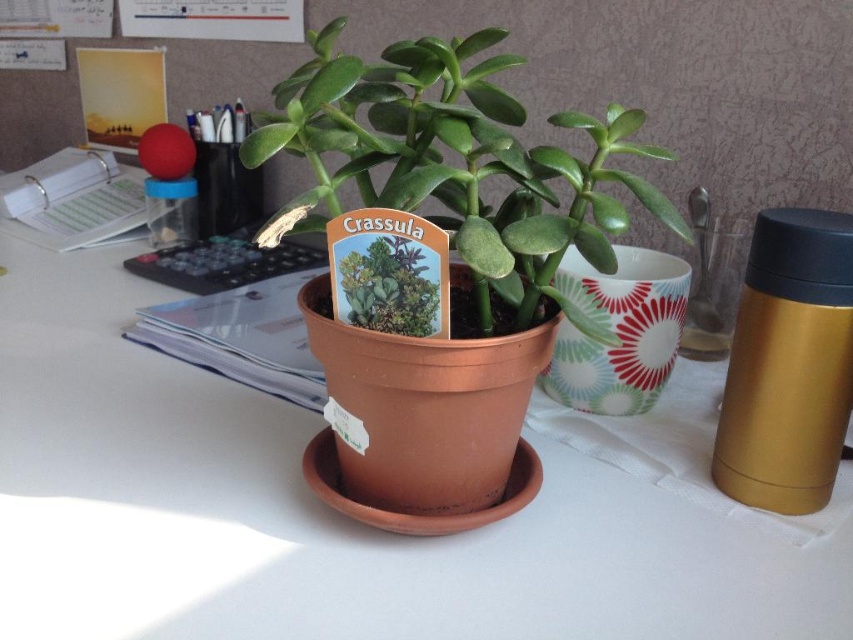
Locate an element on the screen. matte brown pot at center is located at coordinates point(321,513).

Does matte brown pot at center have a lesser width compared to matte clay pot at center?

No, matte brown pot at center is not thinner than matte clay pot at center.

Is point (48, 458) closer to viewer compared to point (583, 184)?

That is False.

At what (x,y) coordinates should I click in order to perform the action: click on matte brown pot at center. Please return your answer as a coordinate pair (x, y). The width and height of the screenshot is (853, 640). Looking at the image, I should click on (321, 513).